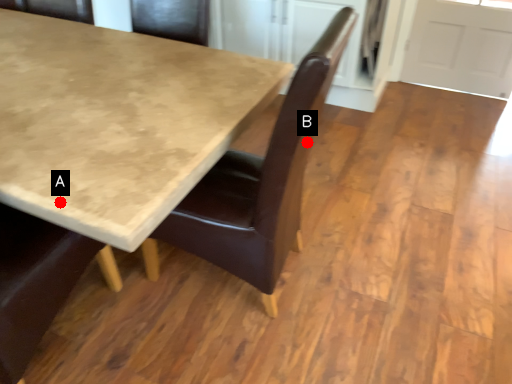
Question: Two points are circled on the image, labeled by A and B beside each circle. Which point is farther from the camera taking this photo?

Choices:
 (A) A is further
 (B) B is further

Answer: (B)